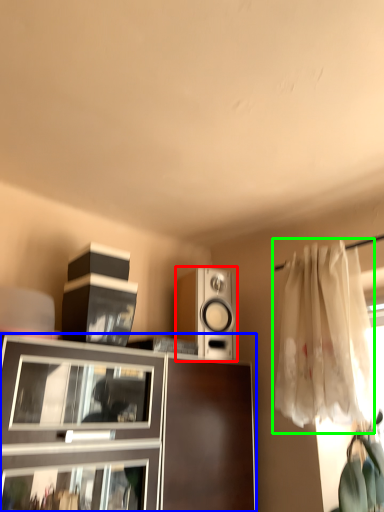
Question: Which is nearer to the loudspeaker (highlighted by a red box)? cabinetry (highlighted by a blue box) or curtain (highlighted by a green box).

Choices:
 (A) cabinetry
 (B) curtain

Answer: (A)